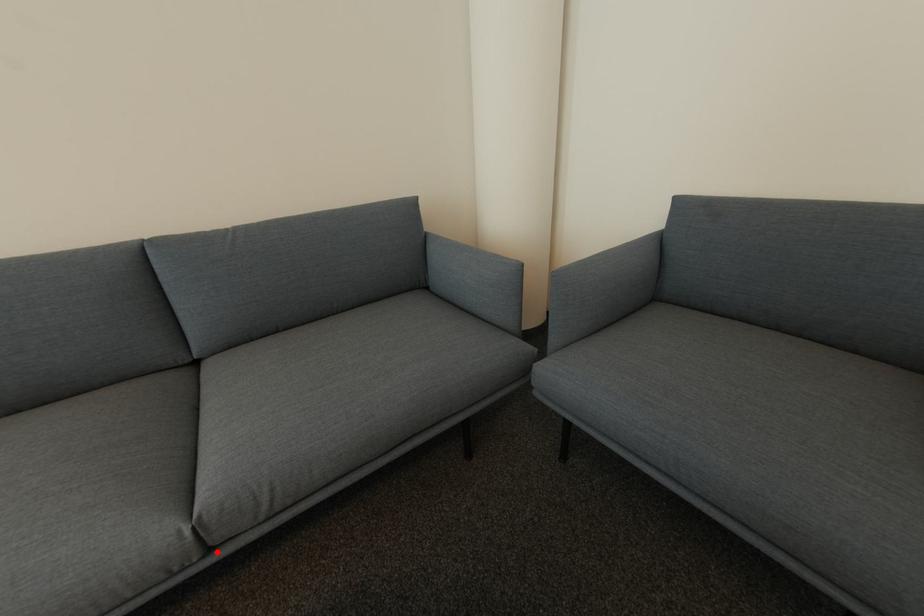
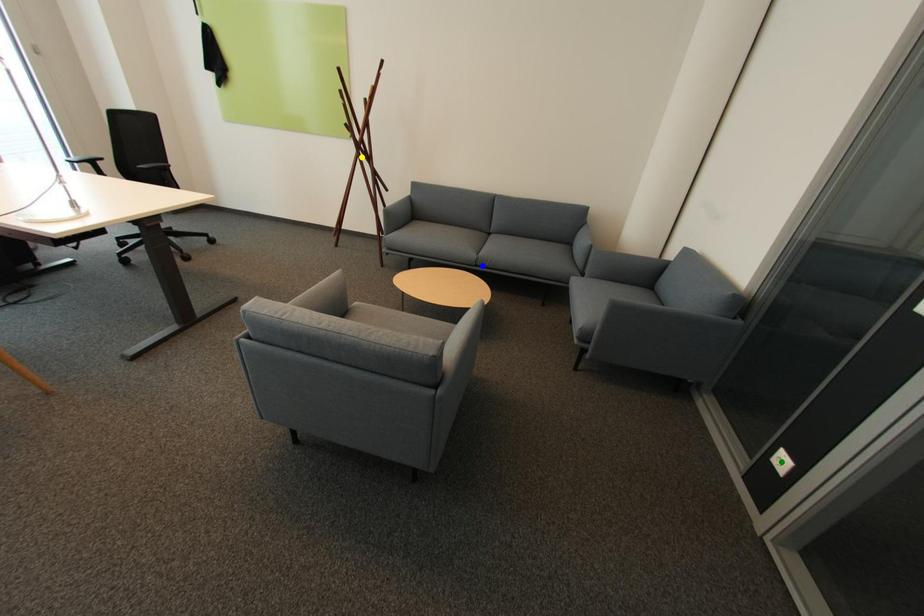
Question: I am providing you with two images of the same scene from different viewpoints. A red point is marked on the first image. You are given multiple points on the second image. Which spot in image 2 lines up with the point in image 1?

Choices:
 (A) yellow point
 (B) green point
 (C) blue point

Answer: (C)